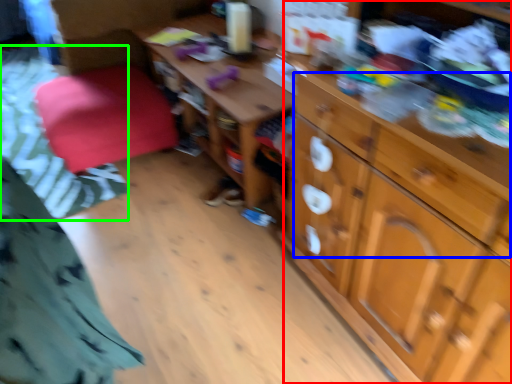
Question: Which is nearer to the cabinetry (highlighted by a red box)? drawer (highlighted by a blue box) or bedding (highlighted by a green box).

Choices:
 (A) drawer
 (B) bedding

Answer: (A)